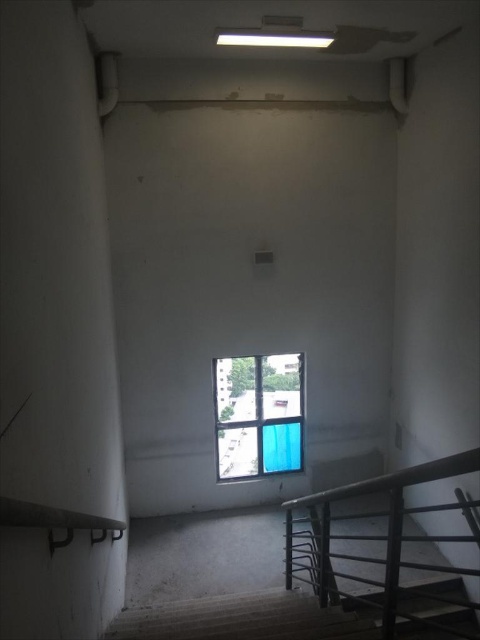
You are a painter holding a 1.2 meter wide painting. You want to hang it on the wall between the metallic gray balustrade at lower right and the blue fabric curtain at center. Can the space between them accommodate your painting?

The metallic gray balustrade at lower right might be wider than blue fabric curtain at center, so the available space between them may not be sufficient to fit a 1.2 meter wide painting. You should measure the exact distance before deciding.

You are a delivery person carrying a large package that measures 24 inches in width. You need to navigate through the stairwell shown in the image. Can you safely pass between the metallic gray balustrade at lower right and the smooth concrete stairs at lower right with your package?

The distance between the metallic gray balustrade at lower right and the smooth concrete stairs at lower right is 22.45 inches. Since your package is 24 inches wide, it is wider than the available space. You will not be able to safely pass through that area with your package.

You are a delivery robot with a width of 1 meter. You need to navigate through the stairwell and pass between the metallic gray balustrade at lower right and the camera. Can you fit through the space between them?

The space between the metallic gray balustrade at lower right and the camera is 1.35 meters, which is wider than your 1 meter width, so you can fit through the space between them.